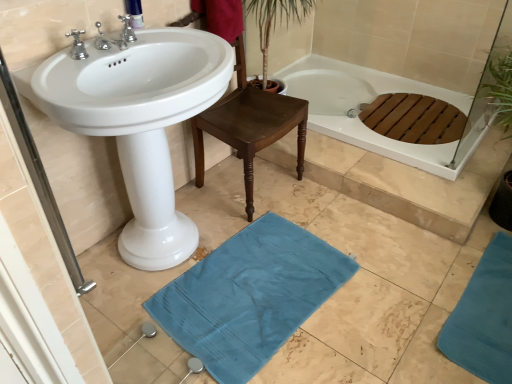
Find the location of a particular element. The width and height of the screenshot is (512, 384). vacant region to the left of satin nickel faucet at upper left, acting as the first tap starting from the front is located at coordinates point(80,61).